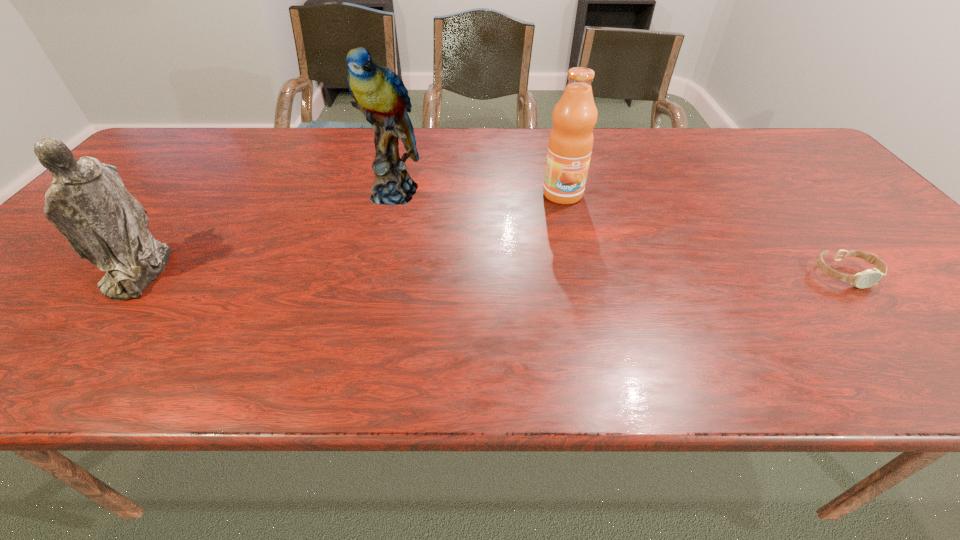
Where is `empty location between the watch and the third object from left to right`? The width and height of the screenshot is (960, 540). empty location between the watch and the third object from left to right is located at coordinates (704, 234).

Select which object is the closest to the figurine. Please provide its 2D coordinates. Your answer should be formatted as a tuple, i.e. [(x, y)], where the tuple contains the x and y coordinates of a point satisfying the conditions above.

[(379, 93)]

The image size is (960, 540). I want to click on object identified as the closest to the fruit juice, so click(x=379, y=93).